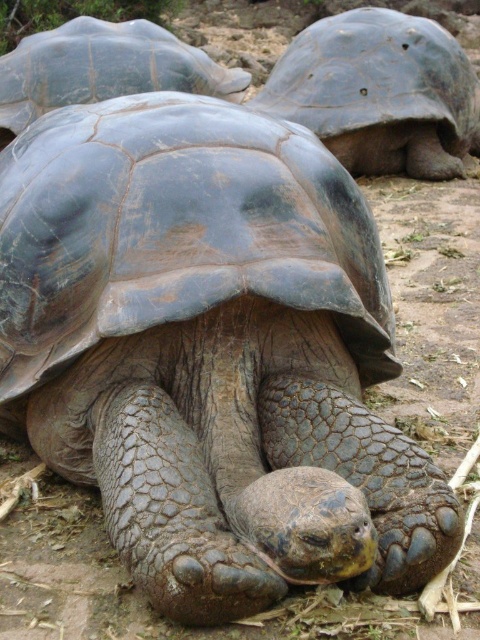
Question: Which point is closer to the camera?

Choices:
 (A) smooth gray tortoise at center
 (B) leathery gray tortoise at upper right

Answer: (A)

Question: Can you confirm if leathery gray tortoise at upper right is thinner than smooth gray tortoise at center?

Choices:
 (A) no
 (B) yes

Answer: (A)

Question: Which point is closer to the camera?

Choices:
 (A) smooth gray tortoise at center
 (B) leathery gray tortoise at upper right

Answer: (A)

Question: Can you confirm if leathery gray tortoise at upper right is positioned above smooth gray tortoise at center?

Choices:
 (A) yes
 (B) no

Answer: (A)

Question: Can you confirm if leathery gray tortoise at upper right is wider than smooth gray tortoise at center?

Choices:
 (A) yes
 (B) no

Answer: (A)